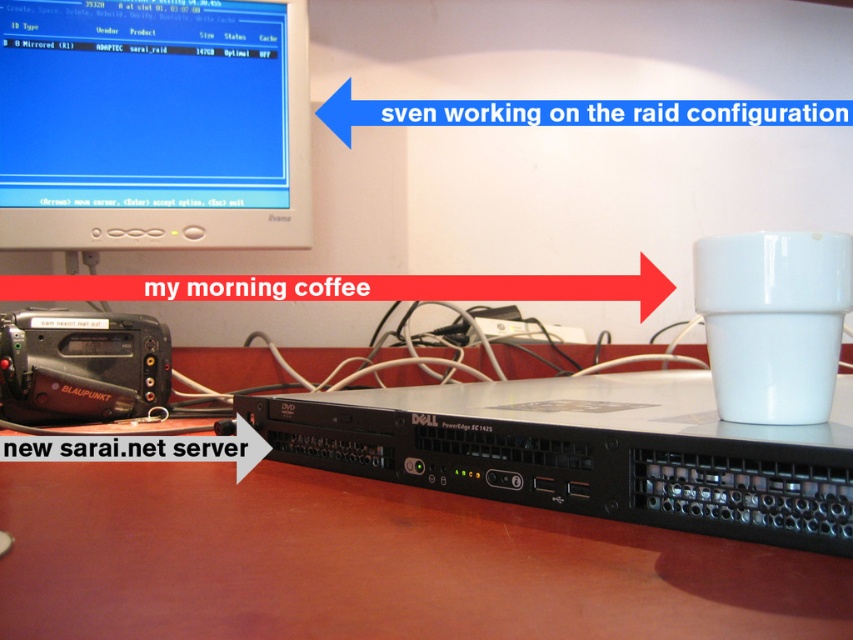
Is brown wooden table at center bigger than matte plastic monitor at upper left?

Actually, brown wooden table at center might be smaller than matte plastic monitor at upper left.

Is brown wooden table at center thinner than matte plastic monitor at upper left?

No, brown wooden table at center is not thinner than matte plastic monitor at upper left.

This screenshot has width=853, height=640. Describe the element at coordinates (372, 563) in the screenshot. I see `brown wooden table at center` at that location.

Identify the location of brown wooden table at center. (372, 563).

Between black plastic server at center and white glossy mug at right, which one appears on the left side from the viewer's perspective?

black plastic server at center is more to the left.

Does point (677, 380) lie in front of point (791, 356)?

No, it is behind (791, 356).

Where is `black plastic server at center`? black plastic server at center is located at coordinates (585, 451).

Who is higher up, matte plastic monitor at upper left or white glossy mug at right?

matte plastic monitor at upper left is higher up.

Is matte plastic monitor at upper left in front of white glossy mug at right?

No, matte plastic monitor at upper left is behind white glossy mug at right.

Locate an element on the screen. This screenshot has width=853, height=640. matte plastic monitor at upper left is located at coordinates (154, 124).